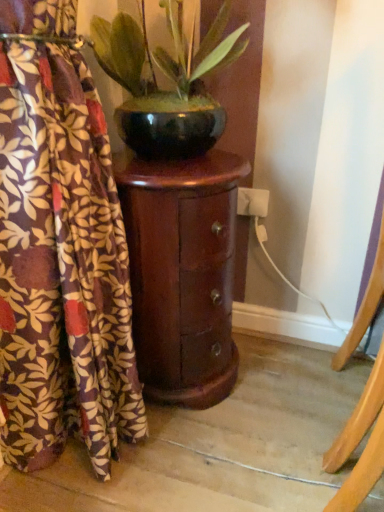
Question: Considering the positions of shiny dark wood cabinet at center and brown floral fabric at left in the image, is shiny dark wood cabinet at center wider or thinner than brown floral fabric at left?

Choices:
 (A) wide
 (B) thin

Answer: (A)

Question: Is shiny dark wood cabinet at center inside or outside of brown floral fabric at left?

Choices:
 (A) outside
 (B) inside

Answer: (A)

Question: Estimate the real-world distances between objects in this image. Which object is closer to the shiny black pot at center?

Choices:
 (A) brown floral fabric at left
 (B) shiny dark wood cabinet at center

Answer: (B)

Question: Which object is the closest to the brown floral fabric at left?

Choices:
 (A) shiny dark wood cabinet at center
 (B) shiny black pot at center

Answer: (A)